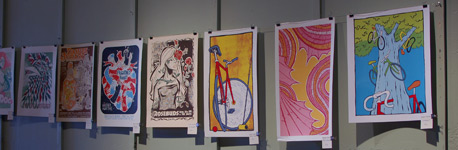
Where is `wall trim`? This screenshot has width=458, height=150. wall trim is located at coordinates (439, 88), (317, 10), (215, 17), (132, 22), (60, 27), (2, 32).